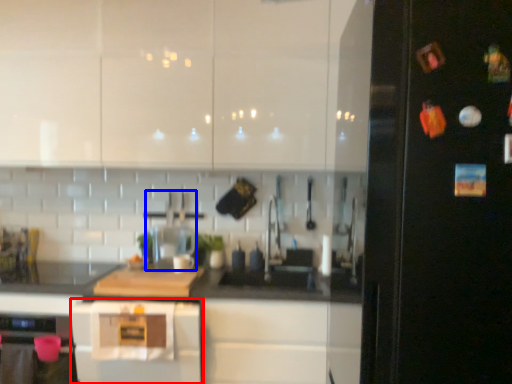
Question: Which object is closer to the camera taking this photo, home appliance (highlighted by a red box) or appliance (highlighted by a blue box)?

Choices:
 (A) home appliance
 (B) appliance

Answer: (A)